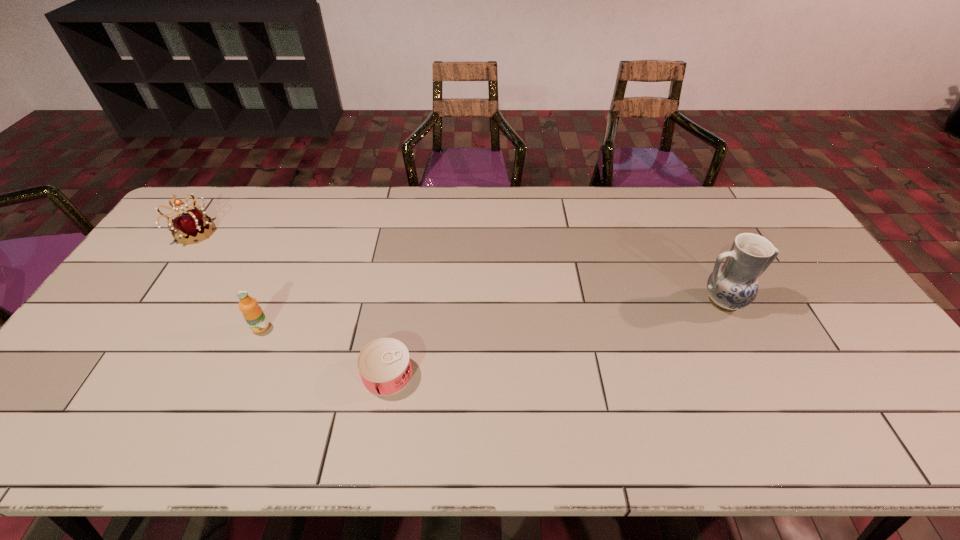
The width and height of the screenshot is (960, 540). Find the location of `the third nearest object`. the third nearest object is located at coordinates (732, 286).

The width and height of the screenshot is (960, 540). What are the coordinates of `pottery` in the screenshot? It's located at (732, 286).

You are a GUI agent. You are given a task and a screenshot of the screen. Output one action in this format:
    pyautogui.click(x=<x>, y=<y>)
    Task: Click on the farthest object
    Image resolution: width=960 pixels, height=540 pixels.
    Given the screenshot: What is the action you would take?
    pyautogui.click(x=192, y=226)

Locate an element on the screen. The width and height of the screenshot is (960, 540). the leftmost object is located at coordinates (192, 226).

In order to click on the second object from left to right in this screenshot , I will do `click(253, 314)`.

At what (x,y) coordinates should I click in order to perform the action: click on orange juice. Please return your answer as a coordinate pair (x, y). This screenshot has height=540, width=960. Looking at the image, I should click on (253, 314).

Where is `the second object from right to left`? the second object from right to left is located at coordinates (384, 365).

Identify the location of the shortest object. Image resolution: width=960 pixels, height=540 pixels. (384, 365).

Find the location of a particular element. This screenshot has height=540, width=960. vacant point located on the back of the second farthest object is located at coordinates (690, 237).

Find the location of a particular element. Image resolution: width=960 pixels, height=540 pixels. vacant region located on the front-facing side of the farthest object is located at coordinates (288, 233).